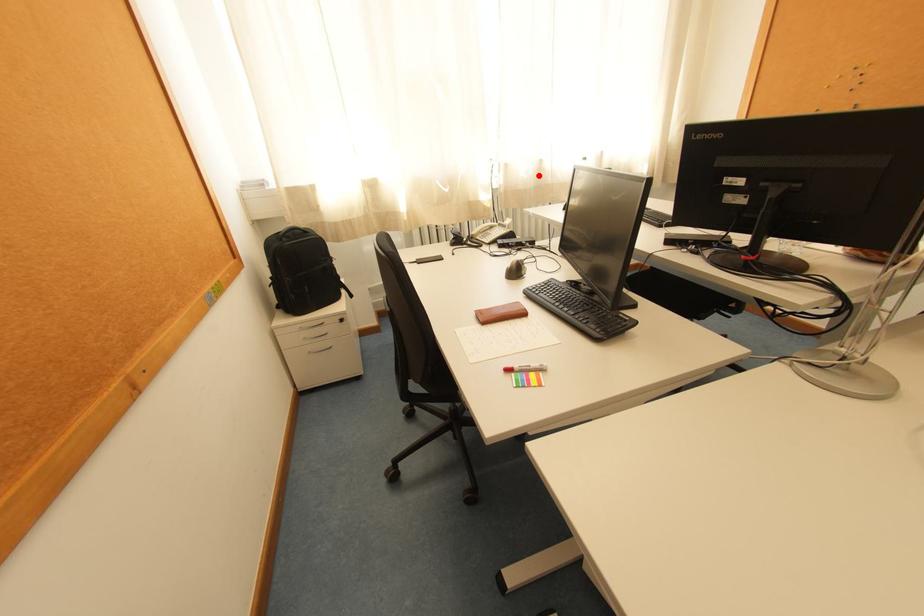
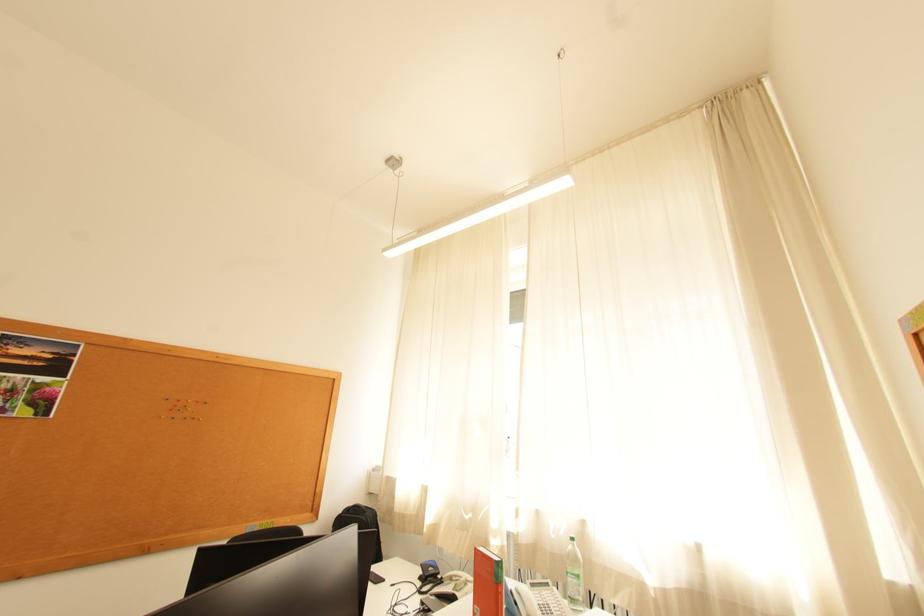
Question: I am providing you with two images of the same scene from different viewpoints. Image1 has a red point marked. In image2, the corresponding 3D location appears at what relative position? Reply with the corresponding letter.

Choices:
 (A) Closer
 (B) Farther

Answer: (B)